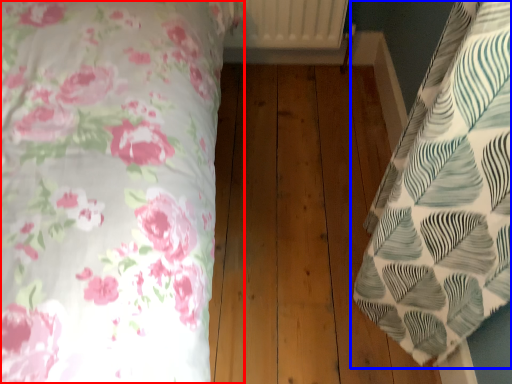
Question: Which point is further to the camera, bed (highlighted by a red box) or bed (highlighted by a blue box)?

Choices:
 (A) bed
 (B) bed

Answer: (B)